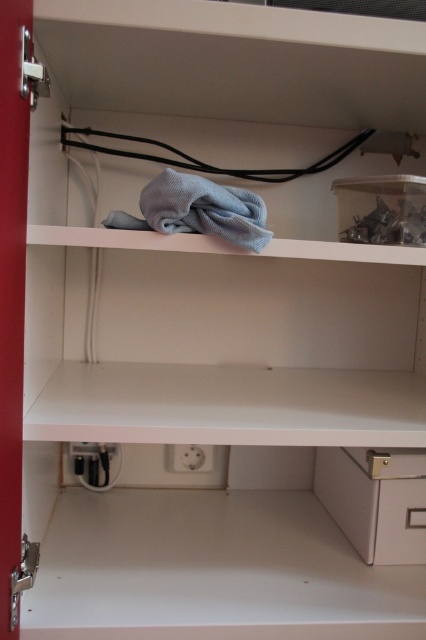
Question: Does gray soft cloth at upper center appear over white plastic electric outlet at lower center?

Choices:
 (A) yes
 (B) no

Answer: (A)

Question: Among these objects, which one is farthest from the camera?

Choices:
 (A) white plastic electric outlet at lower center
 (B) white matte drawer at lower right

Answer: (A)

Question: Which of the following is the farthest from the observer?

Choices:
 (A) white matte drawer at lower right
 (B) gray soft cloth at upper center
 (C) white plastic electric outlet at lower center

Answer: (C)

Question: Is white matte drawer at lower right smaller than gray soft cloth at upper center?

Choices:
 (A) yes
 (B) no

Answer: (B)

Question: Among these objects, which one is nearest to the camera?

Choices:
 (A) white plastic electric outlet at lower center
 (B) white matte drawer at lower right

Answer: (B)

Question: Does white matte drawer at lower right have a lesser width compared to white plastic electric outlet at lower center?

Choices:
 (A) yes
 (B) no

Answer: (B)